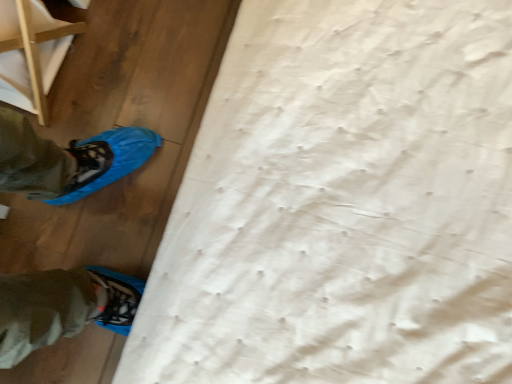
The width and height of the screenshot is (512, 384). What are the coordinates of `vacant area in front of wooden chair at upper left` in the screenshot? It's located at (92, 131).